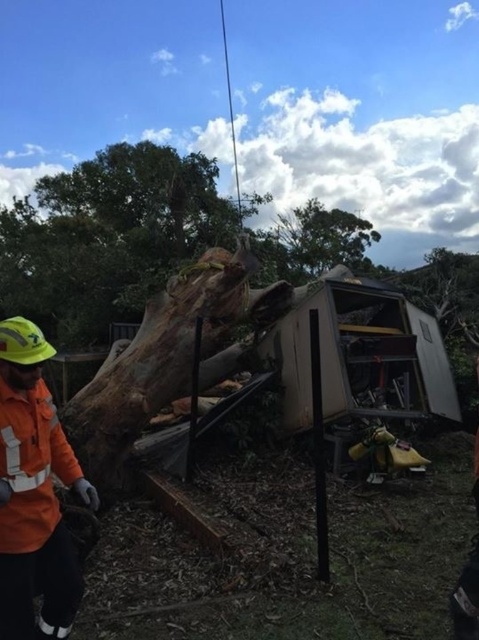
Can you confirm if orange reflective jacket at left is positioned to the right of orange fabric safety vest at lower left?

Indeed, orange reflective jacket at left is positioned on the right side of orange fabric safety vest at lower left.

Locate an element on the screen. orange reflective jacket at left is located at coordinates (34, 493).